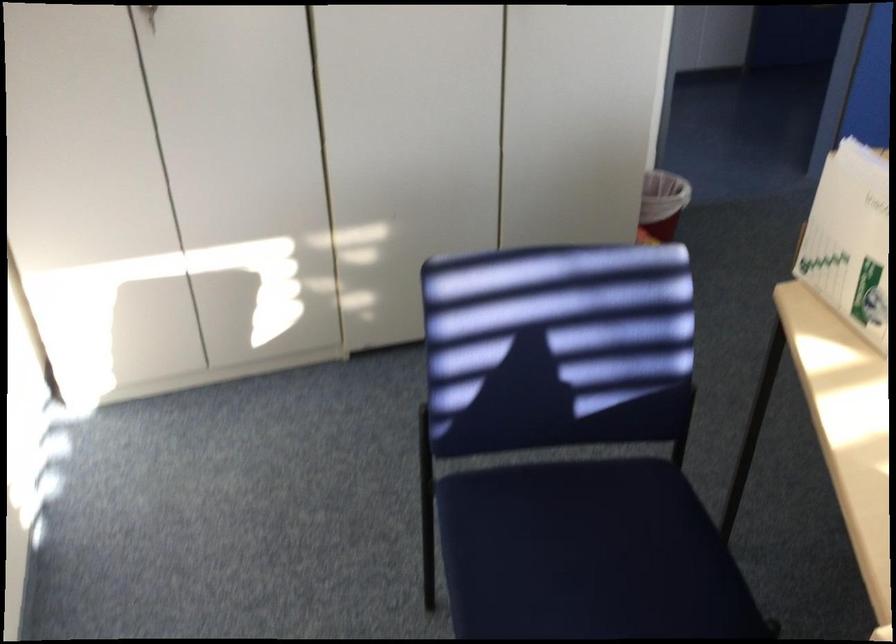
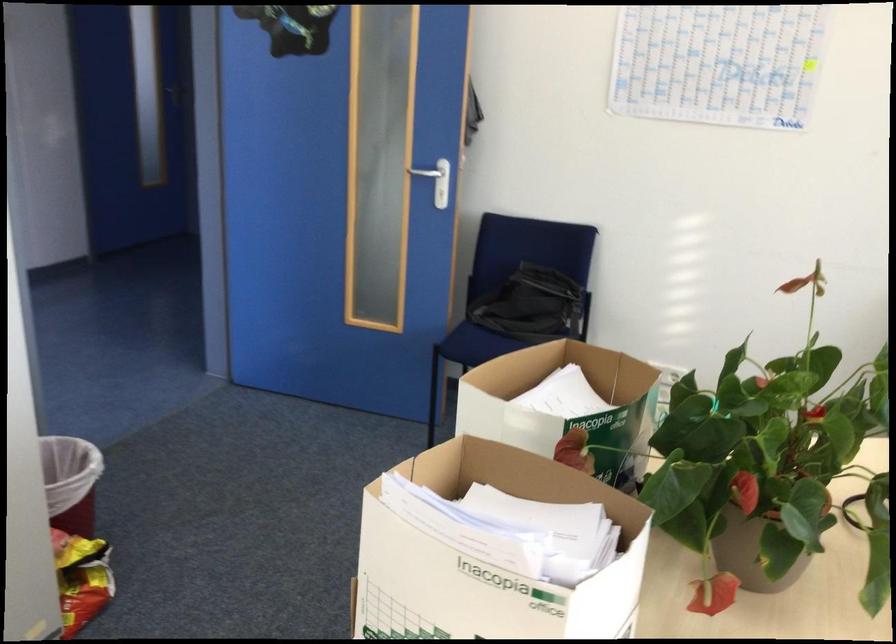
Where in the second image is the point corresponding to pixel 649 185 from the first image?

(71, 482)